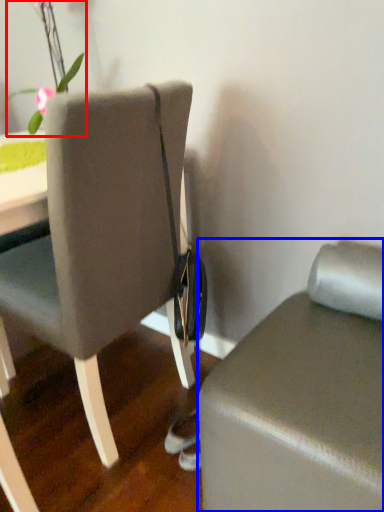
Question: Which point is further to the camera, floral arrangement (highlighted by a red box) or furniture (highlighted by a blue box)?

Choices:
 (A) floral arrangement
 (B) furniture

Answer: (A)